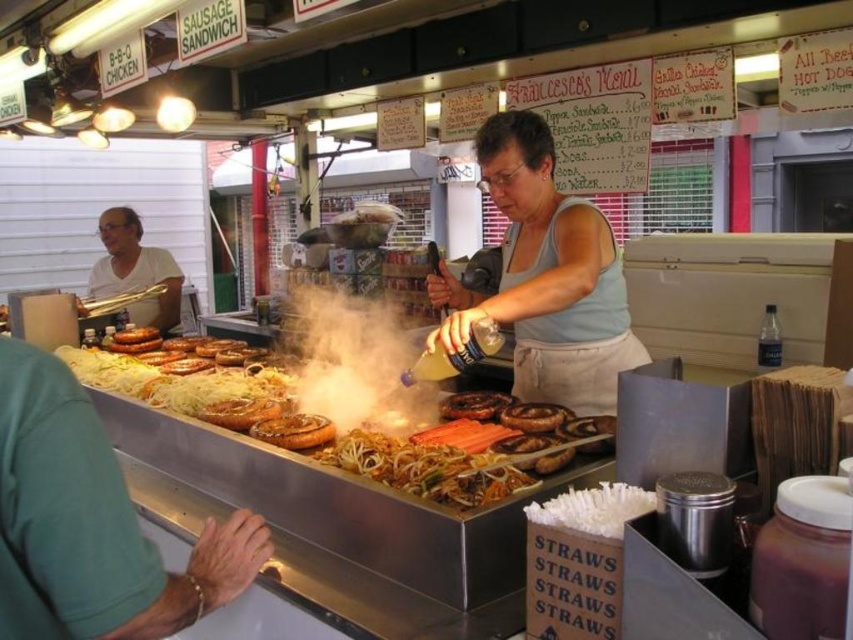
You are standing at the food stall and want to know which of the two points, point [389,392] or point [552,410], is closer to you. Can you determine this based on their positions?

Point [389,392] is closer to you because it is further to the camera than point [552,410].

You are a customer at the food stall and want to order a sausage. The vendor is wearing a light blue tank top and white apron. Which object, the matte white shirt at left or the brown matte sausages at center, is taller?

The matte white shirt at left is taller than the brown matte sausages at center.